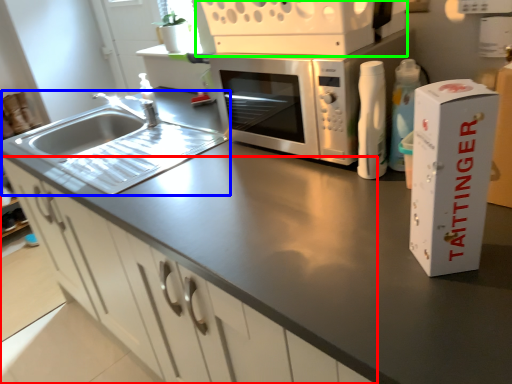
Question: Which object is the farthest from cabinetry (highlighted by a red box)? Choose among these: sink (highlighted by a blue box) or appliance (highlighted by a green box).

Choices:
 (A) sink
 (B) appliance

Answer: (B)